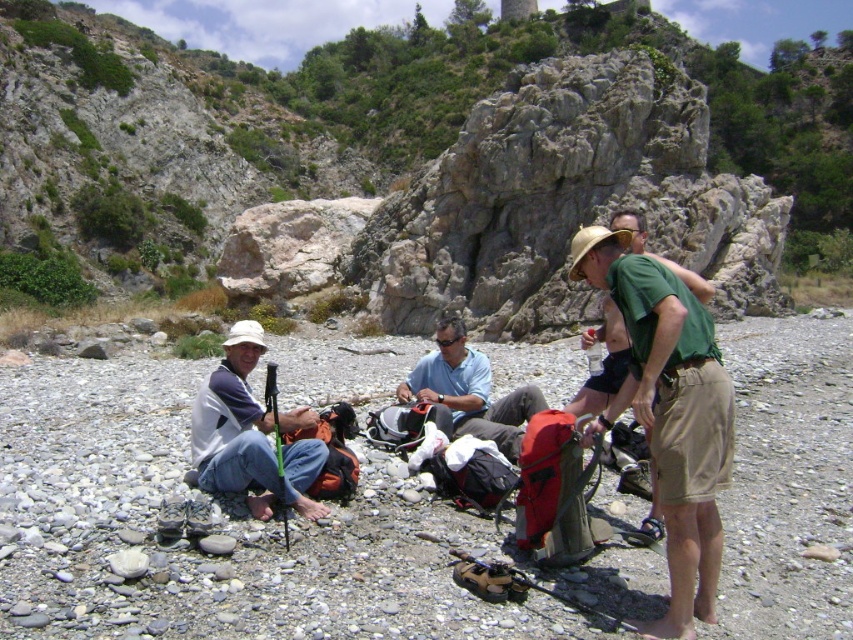
You are a photographer positioned at the center of the scene. You want to capture a photo that includes both the khaki shorts at center and the white matte hat at lower left. Based on their positions, which object should appear lower in the photo?

The khaki shorts at center should appear lower in the photo because it is located below the white matte hat at lower left according to the description.

You are a photographer trying to capture a clear shot of the light blue fabric shirt at center without the white matte hat at lower left blocking it. What adjustment should you make to your camera angle?

The white matte hat at lower left is positioned over the light blue fabric shirt at center. To avoid the hat blocking the shirt, you should lower your camera angle so that the hat moves out of the frame or shifts above the shirt.

You are a photographer positioned at the origin point of the coordinate system. You want to capture a photo of the khaki shorts at center. What are the coordinates where you should aim your camera?

The khaki shorts at center are located at coordinates point (x=669, y=412), so you should aim your camera at those coordinates to capture the photo.